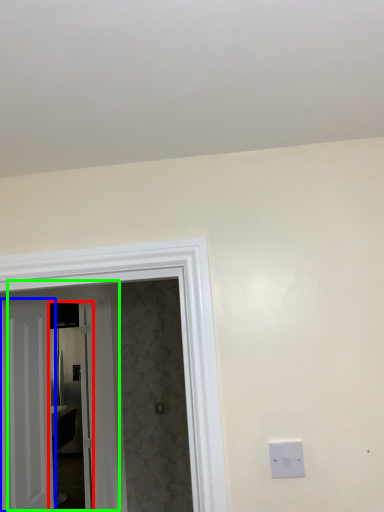
Question: Which object is the farthest from glass door (highlighted by a red box)? Choose among these: door (highlighted by a blue box) or door (highlighted by a green box).

Choices:
 (A) door
 (B) door

Answer: (A)